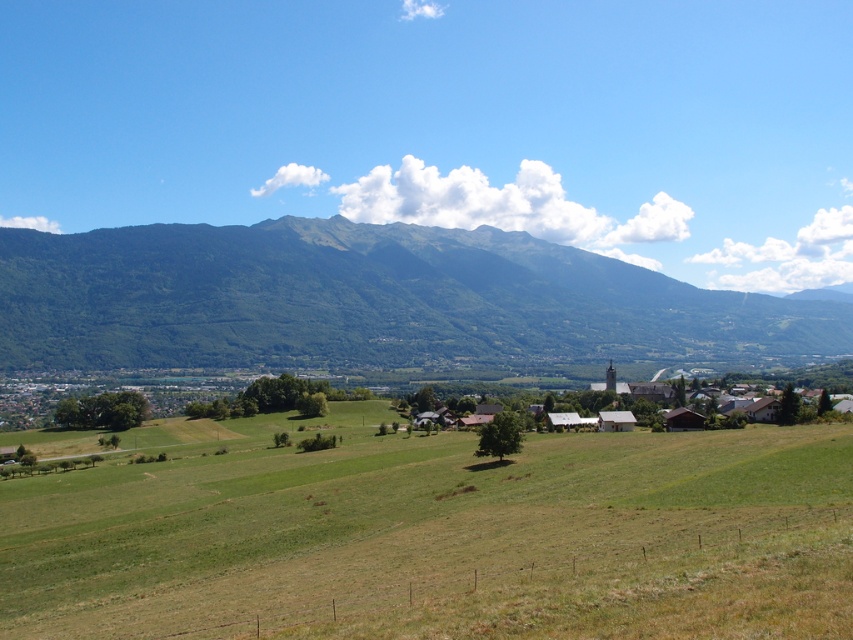
Can you confirm if green grassy field at center is smaller than green forested mountain at center?

Indeed, green grassy field at center has a smaller size compared to green forested mountain at center.

Does point (363, 621) lie behind point (676, 330)?

No, it is in front of (676, 330).

Image resolution: width=853 pixels, height=640 pixels. Find the location of `green grassy field at center`. green grassy field at center is located at coordinates (442, 538).